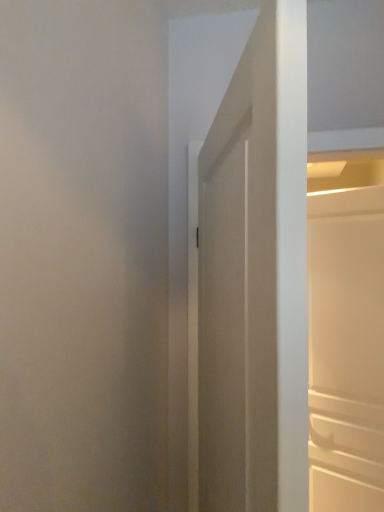
Where is `white matte cabinet at right, the second door viewed from the left`? white matte cabinet at right, the second door viewed from the left is located at coordinates (346, 349).

Image resolution: width=384 pixels, height=512 pixels. What do you see at coordinates (346, 349) in the screenshot?
I see `white matte cabinet at right, which is the second door from front to back` at bounding box center [346, 349].

The height and width of the screenshot is (512, 384). What do you see at coordinates (256, 277) in the screenshot?
I see `white matte door at center, which is the 2th door in back-to-front order` at bounding box center [256, 277].

Locate an element on the screen. white matte door at center, which ranks as the second door in right-to-left order is located at coordinates (256, 277).

Find the location of `white matte cabinet at right, which is the first door from back to front`. white matte cabinet at right, which is the first door from back to front is located at coordinates (346, 349).

Considering the positions of objects white matte cabinet at right, which is the first door from back to front, and white matte door at center, which is the 2th door in back-to-front order, in the image provided, who is more to the left, white matte cabinet at right, which is the first door from back to front, or white matte door at center, which is the 2th door in back-to-front order,?

Positioned to the left is white matte door at center, which is the 2th door in back-to-front order.

Considering their positions, is white matte cabinet at right, which is the first door from back to front, located in front of or behind white matte door at center, which is the 2th door in back-to-front order?

Clearly, white matte cabinet at right, which is the first door from back to front, is behind white matte door at center, which is the 2th door in back-to-front order.

Considering the points (331, 442) and (247, 110), which point is in front, point (331, 442) or point (247, 110)?

The point (247, 110) is closer to the camera.

From the image's perspective, does white matte cabinet at right, the second door viewed from the left, appear lower than white matte door at center, which is the 2th door in back-to-front order?

Yes, from the image's perspective, white matte cabinet at right, the second door viewed from the left, is beneath white matte door at center, which is the 2th door in back-to-front order.

From a real-world perspective, does white matte cabinet at right, which is the second door from front to back, stand above white matte door at center, which is the 1th door in front-to-back order?

No, from a real-world perspective, white matte cabinet at right, which is the second door from front to back, is not over white matte door at center, which is the 1th door in front-to-back order

Is white matte cabinet at right, the first door from the right, wider than white matte door at center, which ranks as the second door in right-to-left order?

In fact, white matte cabinet at right, the first door from the right, might be narrower than white matte door at center, which ranks as the second door in right-to-left order.

Considering the sizes of objects white matte cabinet at right, the first door from the right, and white matte door at center, placed as the first door when sorted from left to right, in the image provided, who is shorter, white matte cabinet at right, the first door from the right, or white matte door at center, placed as the first door when sorted from left to right,?

With less height is white matte door at center, placed as the first door when sorted from left to right.

Based on their sizes in the image, would you say white matte cabinet at right, the first door from the right, is bigger or smaller than white matte door at center, which ranks as the second door in right-to-left order?

Considering their sizes, white matte cabinet at right, the first door from the right, takes up less space than white matte door at center, which ranks as the second door in right-to-left order.

Would you say white matte cabinet at right, which is the first door from back to front, is outside white matte door at center, which is the 1th door in front-to-back order?

Yes.

Is there a large distance between white matte cabinet at right, the second door viewed from the left, and white matte door at center, which is the 1th door in front-to-back order?

That's right, there is a large distance between white matte cabinet at right, the second door viewed from the left, and white matte door at center, which is the 1th door in front-to-back order.

Looking at this image, is white matte cabinet at right, which is the first door from back to front, looking in the opposite direction of white matte door at center, which is the 1th door in front-to-back order?

white matte cabinet at right, which is the first door from back to front, does not have its back to white matte door at center, which is the 1th door in front-to-back order.

How many degrees apart are the facing directions of white matte cabinet at right, the first door from the right, and white matte door at center, placed as the first door when sorted from left to right?

The angular difference between white matte cabinet at right, the first door from the right, and white matte door at center, placed as the first door when sorted from left to right, is 129 degrees.

This screenshot has height=512, width=384. In order to click on door that is under the white matte door at center, which ranks as the second door in right-to-left order (from a real-world perspective) in this screenshot , I will do `click(346, 349)`.

Based on the photo, can you confirm if white matte door at center, which is the 2th door in back-to-front order, is positioned to the right of white matte cabinet at right, which is the second door from front to back?

Incorrect, white matte door at center, which is the 2th door in back-to-front order, is not on the right side of white matte cabinet at right, which is the second door from front to back.

Considering the relative positions of white matte door at center, which is the 2th door in back-to-front order, and white matte cabinet at right, which is the second door from front to back, in the image provided, is white matte door at center, which is the 2th door in back-to-front order, behind white matte cabinet at right, which is the second door from front to back,?

No, it is not.

Which is closer to the camera, (x=261, y=83) or (x=353, y=358)?

The point (x=261, y=83) is more forward.

From the image's perspective, which one is positioned lower, white matte door at center, which ranks as the second door in right-to-left order, or white matte cabinet at right, which is the first door from back to front?

white matte cabinet at right, which is the first door from back to front.

From a real-world perspective, between white matte door at center, which ranks as the second door in right-to-left order, and white matte cabinet at right, which is the second door from front to back, who is vertically higher?

white matte door at center, which ranks as the second door in right-to-left order.

Considering the sizes of objects white matte door at center, which is the 2th door in back-to-front order, and white matte cabinet at right, which is the first door from back to front, in the image provided, who is thinner, white matte door at center, which is the 2th door in back-to-front order, or white matte cabinet at right, which is the first door from back to front,?

white matte cabinet at right, which is the first door from back to front, is thinner.

Considering the relative sizes of white matte door at center, which is the 1th door in front-to-back order, and white matte cabinet at right, which is the second door from front to back, in the image provided, is white matte door at center, which is the 1th door in front-to-back order, shorter than white matte cabinet at right, which is the second door from front to back,?

Yes, white matte door at center, which is the 1th door in front-to-back order, is shorter than white matte cabinet at right, which is the second door from front to back.

Does white matte door at center, which ranks as the second door in right-to-left order, have a smaller size compared to white matte cabinet at right, the first door from the right?

Actually, white matte door at center, which ranks as the second door in right-to-left order, might be larger than white matte cabinet at right, the first door from the right.

Is white matte door at center, placed as the first door when sorted from left to right, inside or outside of white matte cabinet at right, which is the second door from front to back?

white matte door at center, placed as the first door when sorted from left to right, is spatially situated outside white matte cabinet at right, which is the second door from front to back.

Consider the image. Is there a large distance between white matte door at center, which ranks as the second door in right-to-left order, and white matte cabinet at right, which is the second door from front to back?

Yes, white matte door at center, which ranks as the second door in right-to-left order, and white matte cabinet at right, which is the second door from front to back, are quite far apart.

Is white matte door at center, which is the 1th door in front-to-back order, turned away from white matte cabinet at right, which is the second door from front to back?

No, white matte cabinet at right, which is the second door from front to back, is not at the back of white matte door at center, which is the 1th door in front-to-back order.

Measure the distance from white matte door at center, placed as the first door when sorted from left to right, to white matte cabinet at right, which is the second door from front to back.

white matte door at center, placed as the first door when sorted from left to right, is 4.29 feet from white matte cabinet at right, which is the second door from front to back.

Where is `door located above the white matte cabinet at right, which is the second door from front to back (from a real-world perspective)`? This screenshot has height=512, width=384. door located above the white matte cabinet at right, which is the second door from front to back (from a real-world perspective) is located at coordinates (256, 277).

Identify the location of door in front of the white matte cabinet at right, the second door viewed from the left. (256, 277).

Image resolution: width=384 pixels, height=512 pixels. I want to click on door below the white matte door at center, placed as the first door when sorted from left to right (from the image's perspective), so click(x=346, y=349).